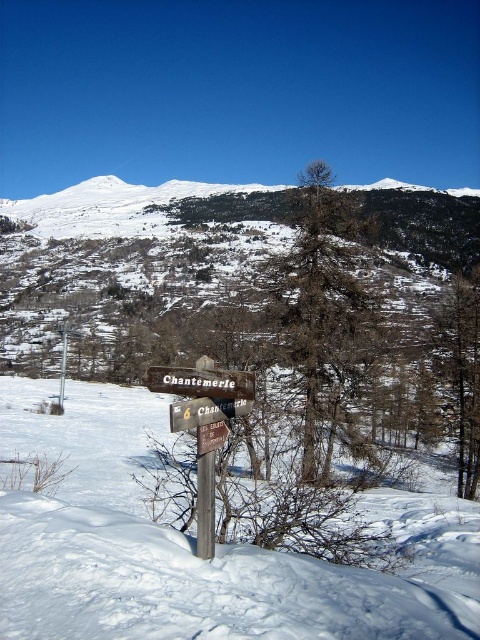
You are standing at the wooden signpost in the foreground of the winter landscape. You notice two points marked on the terrain ahead of you. Which of the two points, point 1 at coordinates point (148, 387) or point 2 at coordinates point (189, 420), is closer to your current position?

Point 1 at coordinates point (148, 387) is closer to your current position because it is further to the viewer than point 2 at coordinates point (189, 420).